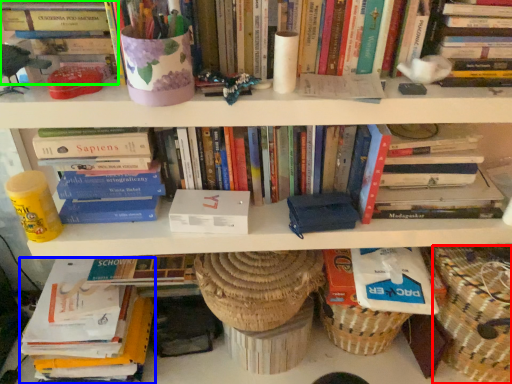
Question: Based on their relative distances, which object is farther from basket (highlighted by a red box)? Choose from book (highlighted by a blue box) and book (highlighted by a green box).

Choices:
 (A) book
 (B) book

Answer: (B)